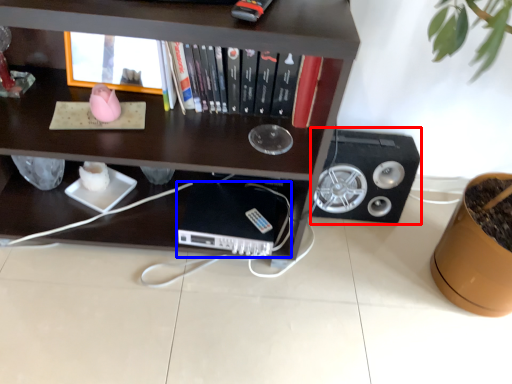
Question: Which point is further to the camera, speaker (highlighted by a red box) or computer (highlighted by a blue box)?

Choices:
 (A) speaker
 (B) computer

Answer: (A)